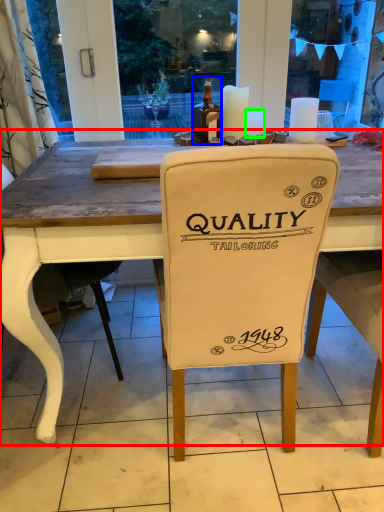
Question: Which object is positioned closest to table (highlighted by a red box)? Select from bottle (highlighted by a blue box) and candle (highlighted by a green box).

Choices:
 (A) bottle
 (B) candle

Answer: (A)